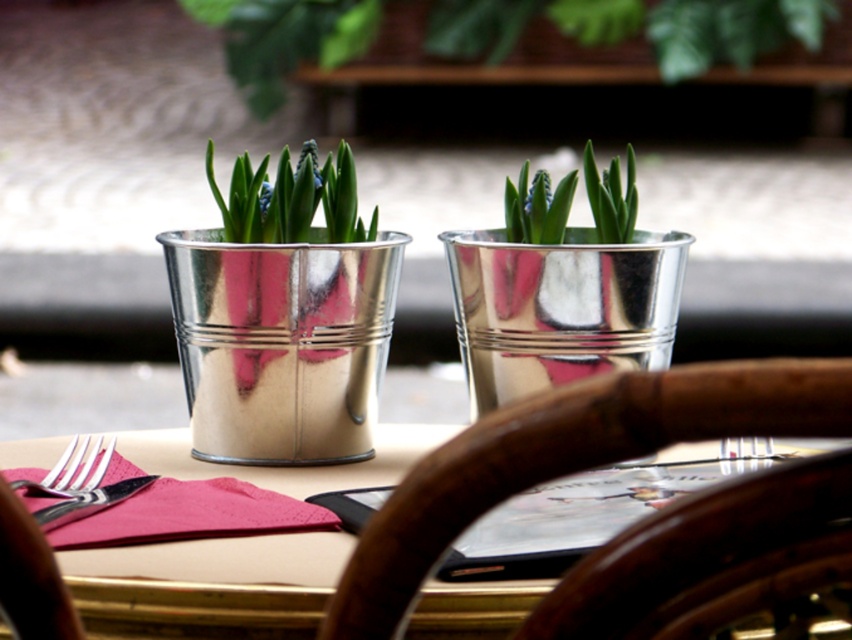
Question: Does green leafy plant at upper center appear under silver metallic fork at left?

Choices:
 (A) yes
 (B) no

Answer: (B)

Question: Does wooden chair back at center have a smaller size compared to metallic silver pot at center?

Choices:
 (A) no
 (B) yes

Answer: (A)

Question: Based on their relative distances, which object is farther from the polished silver fork at lower left?

Choices:
 (A) wooden chair back at center
 (B) silver metallic fork at left

Answer: (A)

Question: Which point appears closest to the camera in this image?

Choices:
 (A) (482, 472)
 (B) (13, 483)
 (C) (68, 467)

Answer: (A)

Question: Does wooden chair back at center lie in front of silver metallic fork at left?

Choices:
 (A) yes
 (B) no

Answer: (A)

Question: Which object is positioned closest to the metallic silver pot at center?

Choices:
 (A) wooden chair back at center
 (B) green leafy plant at upper center

Answer: (A)